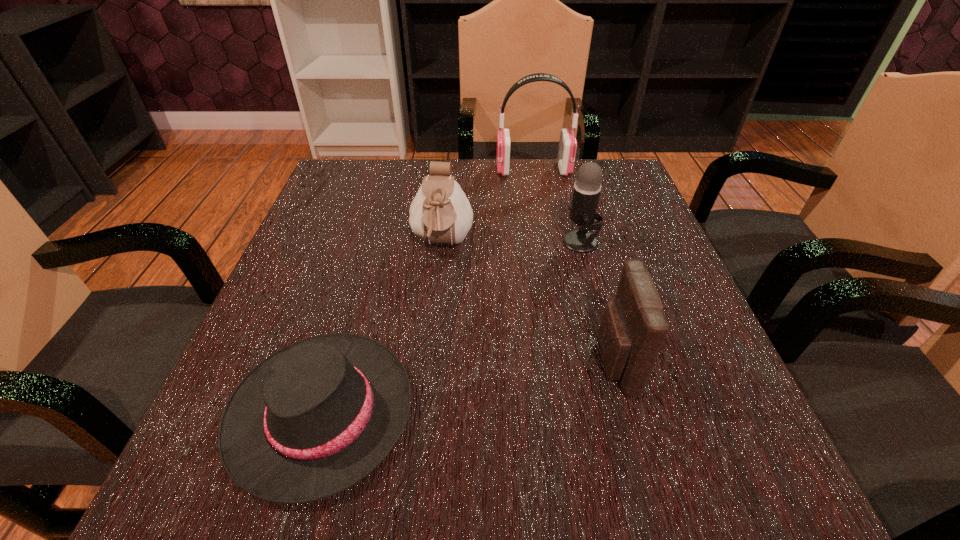
Identify the location of earphone. (567, 148).

Locate an element on the screen. the tallest object is located at coordinates (567, 148).

Image resolution: width=960 pixels, height=540 pixels. I want to click on microphone, so click(587, 187).

Identify the location of the farther pouch. This screenshot has height=540, width=960. (440, 213).

Find the location of `the right pouch`. the right pouch is located at coordinates (633, 328).

The width and height of the screenshot is (960, 540). I want to click on the shortest object, so click(314, 418).

Where is `vacant space located 0.310m on the outer surface of the earphone`? This screenshot has height=540, width=960. vacant space located 0.310m on the outer surface of the earphone is located at coordinates (375, 170).

You are a GUI agent. You are given a task and a screenshot of the screen. Output one action in this format:
    pyautogui.click(x=<x>, y=<y>)
    Task: Click on the vacant space located on the outer surface of the earphone
    The image size is (960, 540).
    Given the screenshot: What is the action you would take?
    pyautogui.click(x=430, y=170)

Image resolution: width=960 pixels, height=540 pixels. Identify the location of blank area located 0.280m on the outer surface of the earphone. (387, 170).

You are a GUI agent. You are given a task and a screenshot of the screen. Output one action in this format:
    pyautogui.click(x=<x>, y=<y>)
    Task: Click on the free space located on the front of the microphone
    Image resolution: width=960 pixels, height=540 pixels.
    Given the screenshot: What is the action you would take?
    pyautogui.click(x=612, y=362)